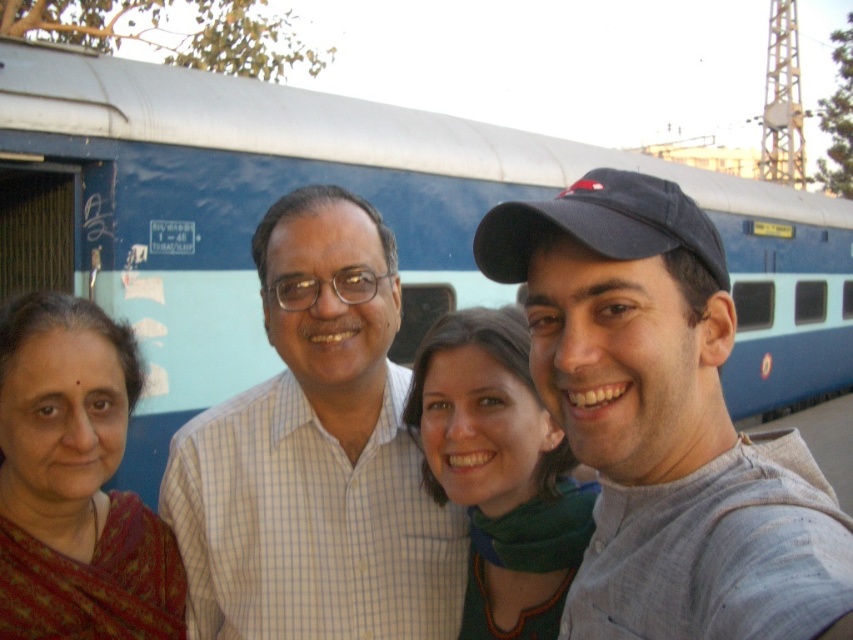
Is gray cotton cap at upper right positioned behind green fabric scarf at center?

No.

The image size is (853, 640). Find the location of `gray cotton cap at upper right`. gray cotton cap at upper right is located at coordinates (662, 422).

Describe the element at coordinates (662, 422) in the screenshot. The height and width of the screenshot is (640, 853). I see `gray cotton cap at upper right` at that location.

I want to click on gray cotton cap at upper right, so click(x=662, y=422).

Does gray cotton cap at upper right have a greater width compared to white checkered shirt at center?

No, gray cotton cap at upper right is not wider than white checkered shirt at center.

Does point (648, 348) come closer to viewer compared to point (262, 572)?

Yes.

Identify the location of gray cotton cap at upper right. (662, 422).

Can you confirm if blue painted train at center is smaller than reddish-brown sari at left?

Incorrect, blue painted train at center is not smaller in size than reddish-brown sari at left.

Can you confirm if blue painted train at center is bigger than reddish-brown sari at left?

Correct, blue painted train at center is larger in size than reddish-brown sari at left.

Is point (741, 397) more distant than point (109, 406)?

That is True.

The image size is (853, 640). I want to click on blue painted train at center, so click(x=352, y=192).